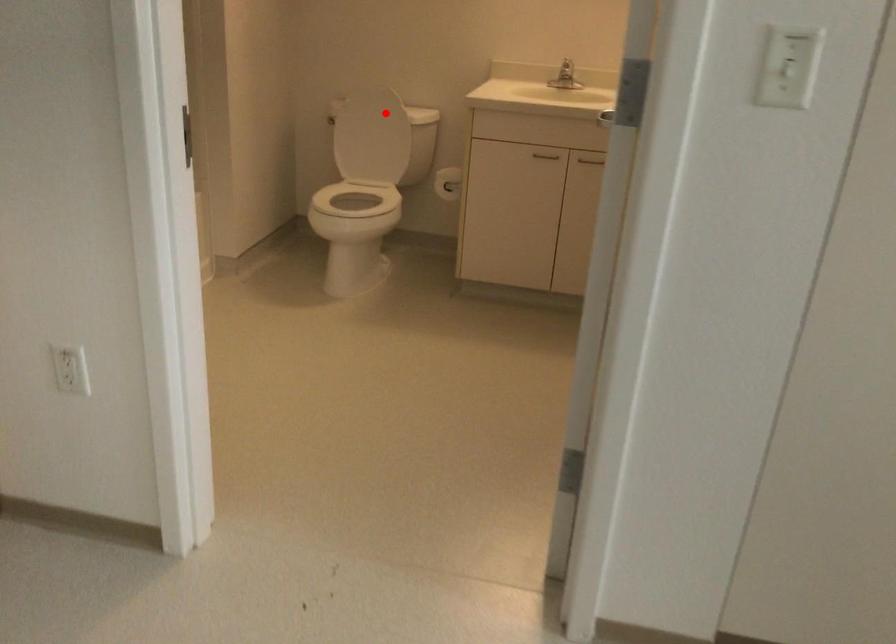
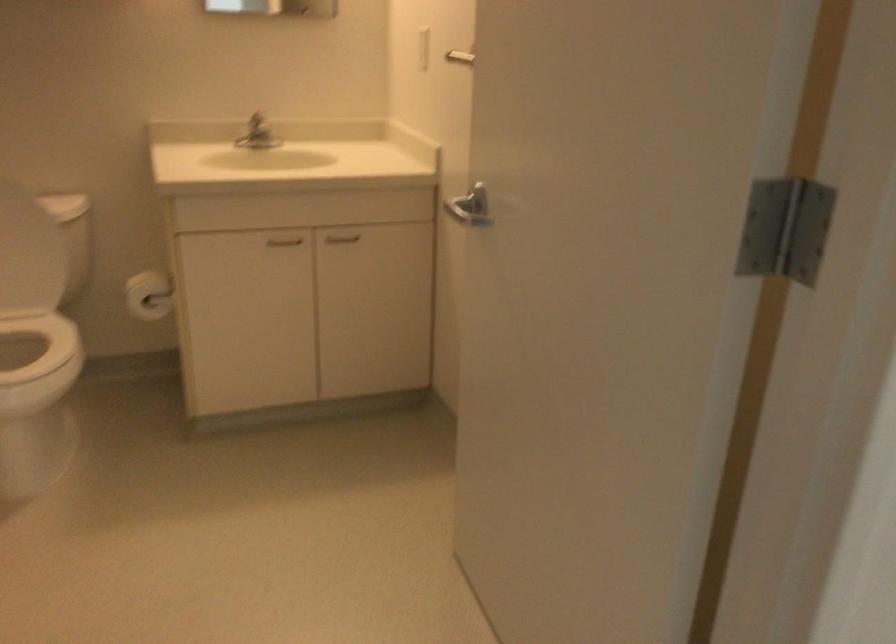
Locate, in the second image, the point that corresponds to the highlighted location in the first image.

(12, 210)